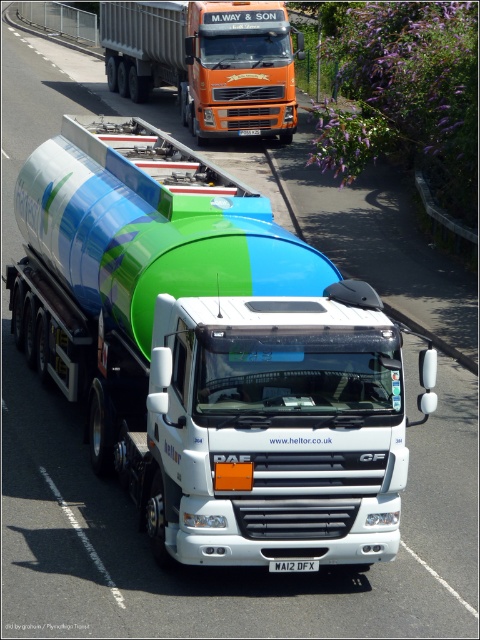
Question: Can you confirm if green matte tanker at center is wider than orange metallic truck at upper center?

Choices:
 (A) no
 (B) yes

Answer: (A)

Question: Which point is farther from the camera taking this photo?

Choices:
 (A) (139, 8)
 (B) (319, 260)

Answer: (A)

Question: Which of the following is the closest to the observer?

Choices:
 (A) (276, 3)
 (B) (37, 244)

Answer: (B)

Question: Is the position of green matte tanker at center more distant than that of orange metallic truck at upper center?

Choices:
 (A) yes
 (B) no

Answer: (B)

Question: Can you confirm if green matte tanker at center is positioned above orange metallic truck at upper center?

Choices:
 (A) no
 (B) yes

Answer: (A)